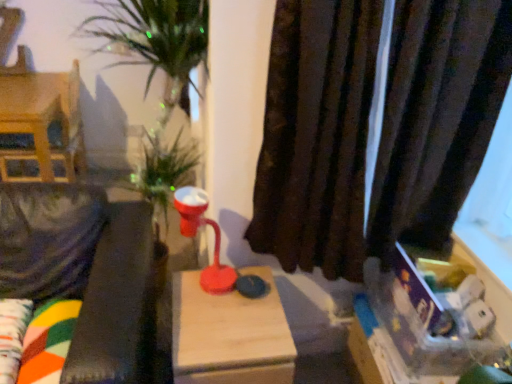
I want to click on free space in front of matte plastic table lamp at center, so click(206, 316).